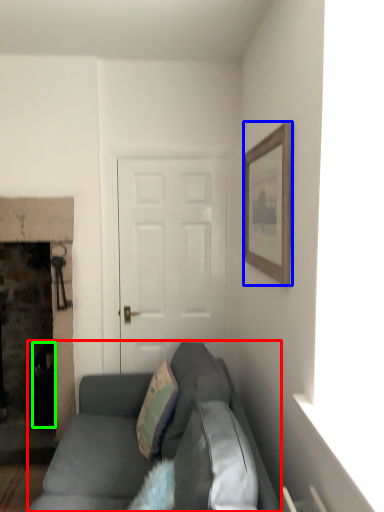
Question: Considering the real-world distances, which object is farthest from studio couch (highlighted by a red box)? picture frame (highlighted by a blue box) or trash bin/can (highlighted by a green box)?

Choices:
 (A) picture frame
 (B) trash bin/can

Answer: (A)